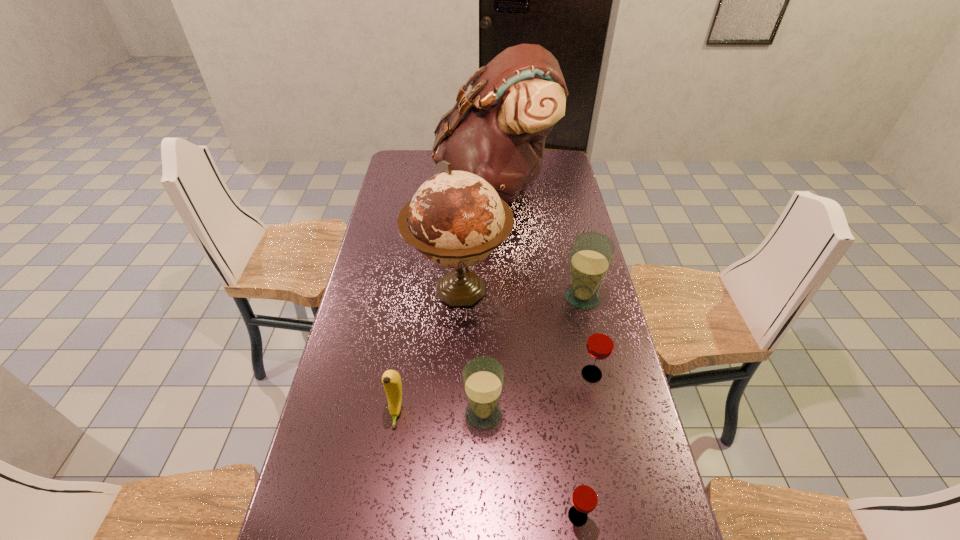
The height and width of the screenshot is (540, 960). Find the location of `free area in between the fourth farthest object and the nearer red glass`. free area in between the fourth farthest object and the nearer red glass is located at coordinates (585, 445).

Where is `free space between the nearest glass and the farther blue glass`? free space between the nearest glass and the farther blue glass is located at coordinates (580, 407).

Find the location of a particular element. empty location between the banana and the third farthest glass is located at coordinates (440, 413).

Select which object appears as the third closest to the banana. Please provide its 2D coordinates. Your answer should be formatted as a tuple, i.e. [(x, y)], where the tuple contains the x and y coordinates of a point satisfying the conditions above.

[(585, 496)]

Find the location of a particular element. object that is the sixth nearest to the farthest glass is located at coordinates (585, 496).

Point out which glass is positioned as the second nearest to the second glass from left to right. Please provide its 2D coordinates. Your answer should be formatted as a tuple, i.e. [(x, y)], where the tuple contains the x and y coordinates of a point satisfying the conditions above.

[(600, 344)]

Locate which glass is the second closest to the leftmost glass. Please provide its 2D coordinates. Your answer should be formatted as a tuple, i.e. [(x, y)], where the tuple contains the x and y coordinates of a point satisfying the conditions above.

[(600, 344)]

This screenshot has height=540, width=960. In order to click on the closest blue glass relative to the second farthest glass in this screenshot , I will do `click(591, 254)`.

This screenshot has height=540, width=960. In order to click on blue glass that is the second closest to the globe in this screenshot , I will do `click(483, 378)`.

You are a GUI agent. You are given a task and a screenshot of the screen. Output one action in this format:
    pyautogui.click(x=<x>, y=<y>)
    Task: Click on the free space that satisfies the following two spatial constraints: 1. at the front of the tallest object with buckles; 2. on the front side of the leftmost glass
    The height and width of the screenshot is (540, 960).
    Given the screenshot: What is the action you would take?
    pyautogui.click(x=503, y=413)